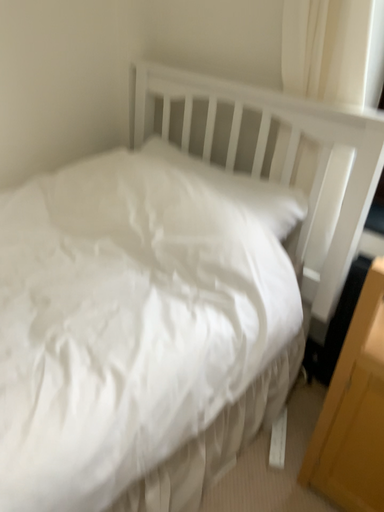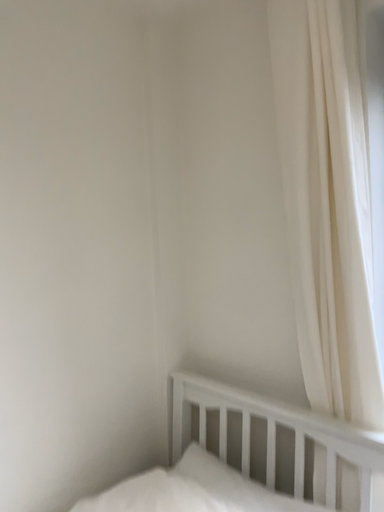
Question: How did the camera likely rotate when shooting the video?

Choices:
 (A) rotated upward
 (B) rotated downward

Answer: (A)